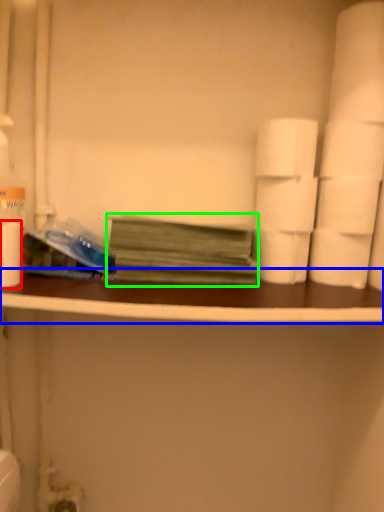
Question: Which object is positioned closest to paper towel (highlighted by a red box)? Select from ledge (highlighted by a blue box) and book (highlighted by a green box).

Choices:
 (A) ledge
 (B) book

Answer: (B)